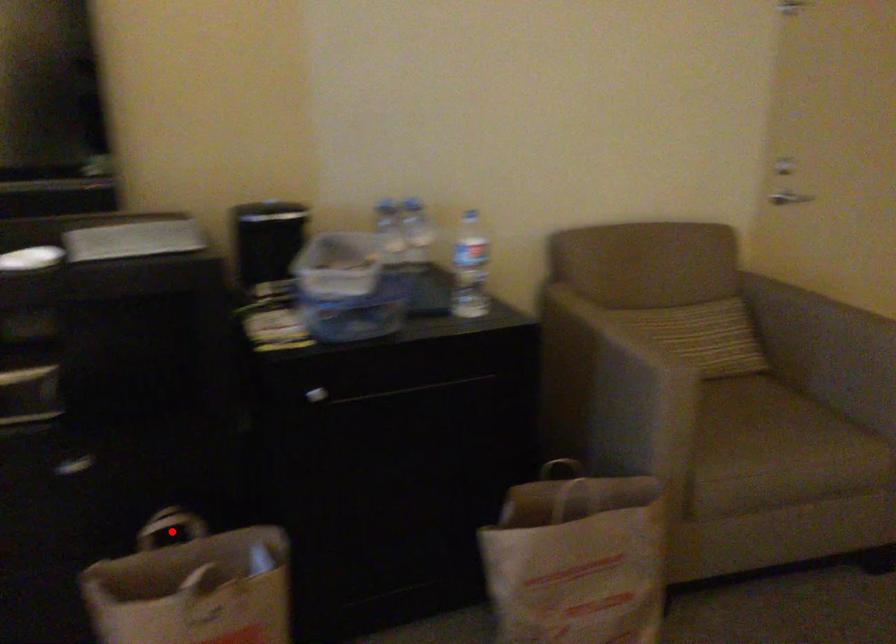
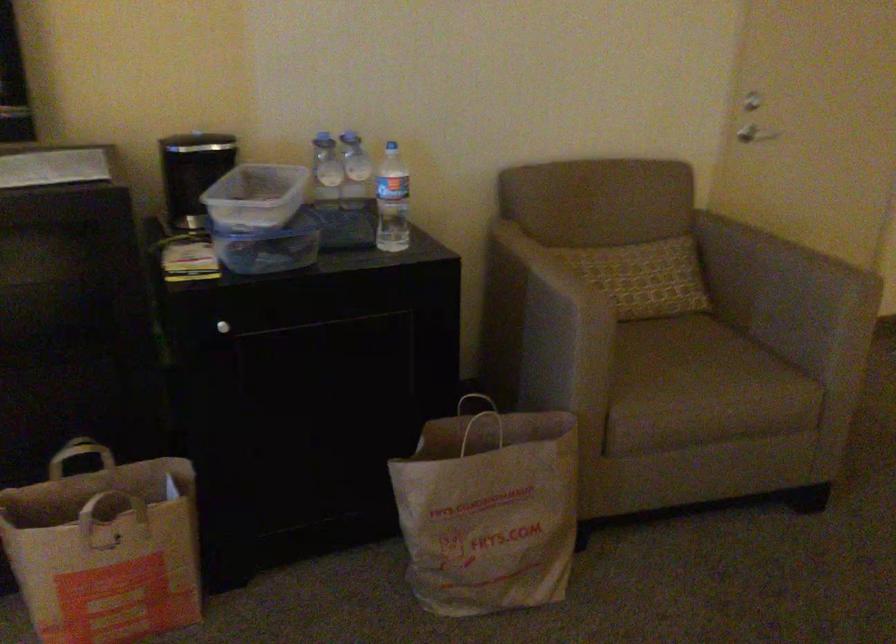
Where in the second image is the point corresponding to the highlighted location from the first image?

(82, 458)